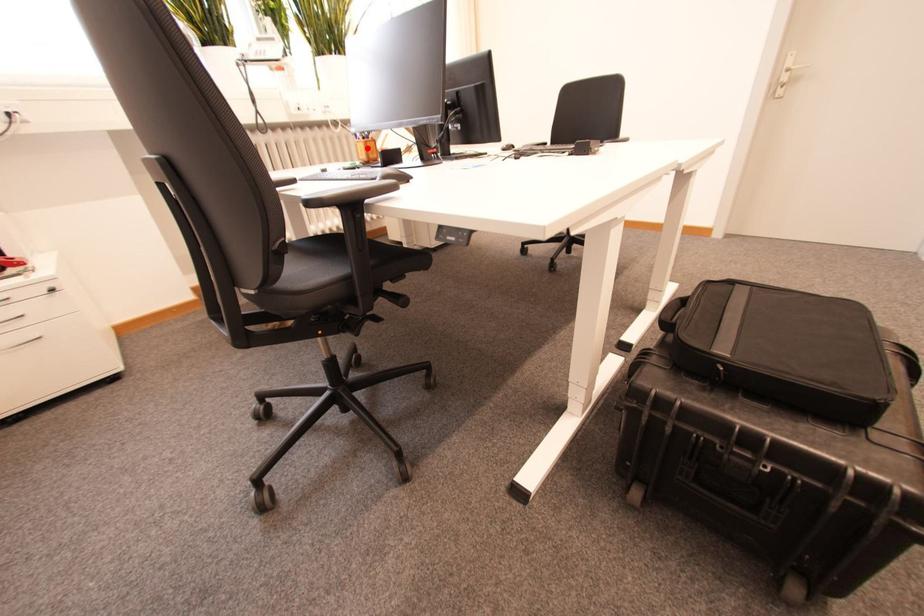
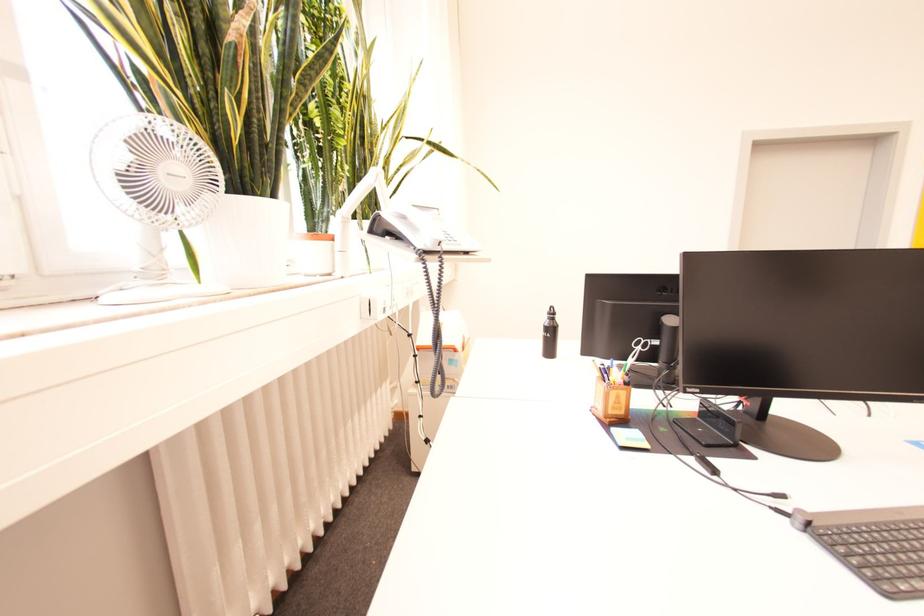
Locate, in the second image, the point that corresponds to the highlighted location in the first image.

(625, 398)